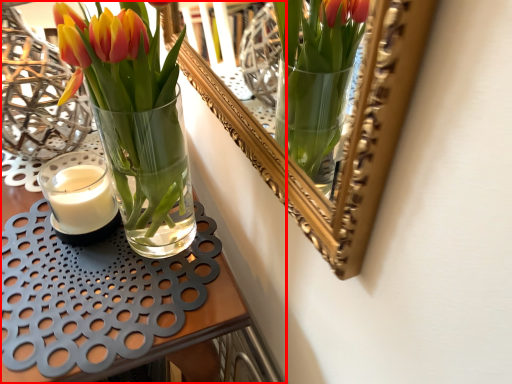
Question: From the image, what is the correct spatial relationship of table (annotated by the red box) in relation to candle?

Choices:
 (A) right
 (B) left

Answer: (B)